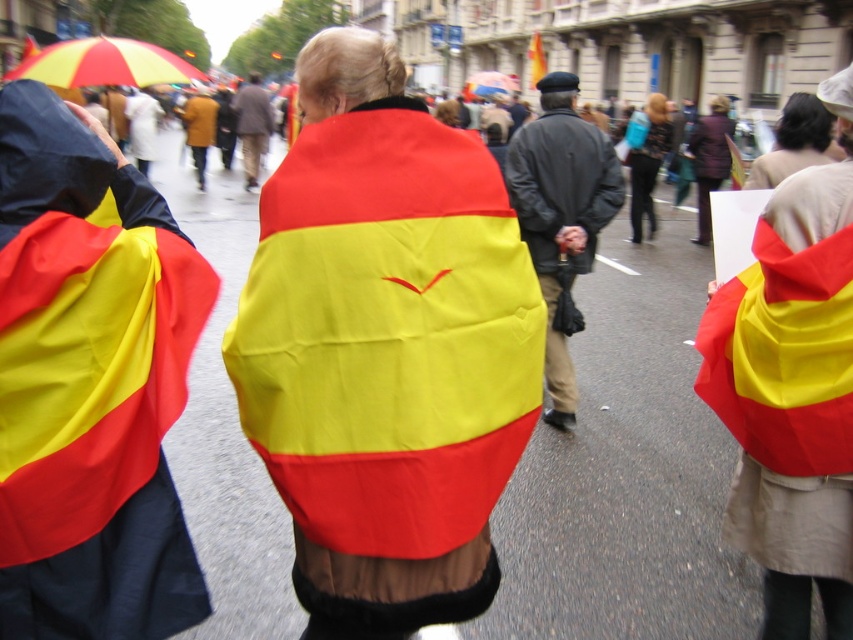
Question: Which is farther from the rainbow fabric umbrella at upper center?

Choices:
 (A) leather jacket at center
 (B) brown leather jacket at center
 (C) dark gray matte jacket at center
 (D) yellow and red striped umbrella at upper left

Answer: (A)

Question: Which of these objects is positioned farthest from the rainbow fabric umbrella at upper center?

Choices:
 (A) matte fabric flag at center
 (B) dark gray matte jacket at center
 (C) brown leather jacket at center

Answer: (A)

Question: Which point is farther to the camera?

Choices:
 (A) (521, 136)
 (B) (57, 61)
 (C) (253, 141)

Answer: (C)

Question: Is the position of matte fabric flag at center more distant than that of rainbow fabric umbrella at upper center?

Choices:
 (A) yes
 (B) no

Answer: (B)

Question: Can you confirm if matte fabric flag at center is positioned above yellow and red striped umbrella at upper left?

Choices:
 (A) no
 (B) yes

Answer: (A)

Question: Does yellow and red striped umbrella at upper left lie in front of brown leather jacket at center?

Choices:
 (A) yes
 (B) no

Answer: (A)